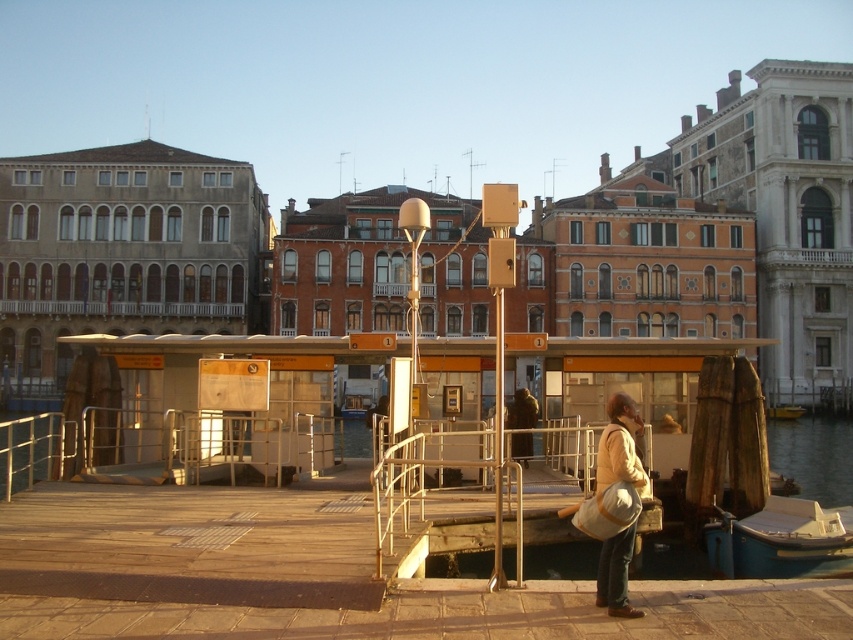
You are a tourist standing on the wooden dock holding the light brown fabric bag at lower right. You want to board the blue plastic boat at lower right. Is the boat to your left or right side?

The blue plastic boat at lower right is to the right of light brown fabric bag at lower right, so the boat is to your right side.

You are a tourist standing on the wooden dock and you see the blue plastic boat at lower right and the light brown fabric bag at lower right. Which object is larger in size?

The blue plastic boat at lower right is bigger than the light brown fabric bag at lower right.